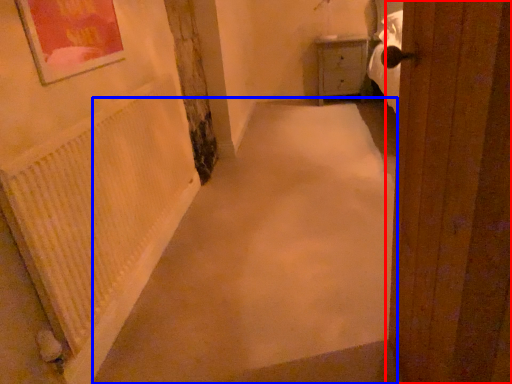
Question: Which point is further to the camera, door (highlighted by a red box) or alley (highlighted by a blue box)?

Choices:
 (A) door
 (B) alley

Answer: (B)